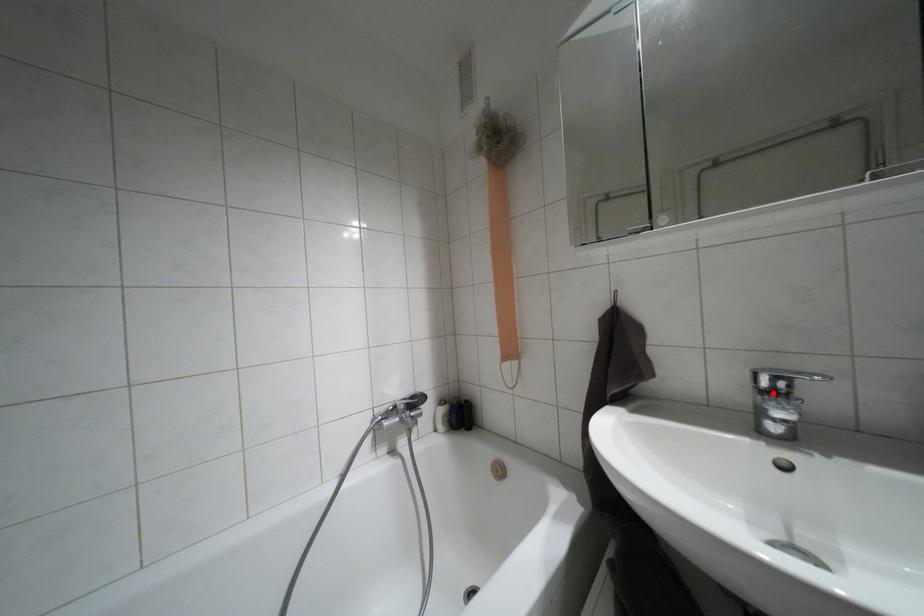
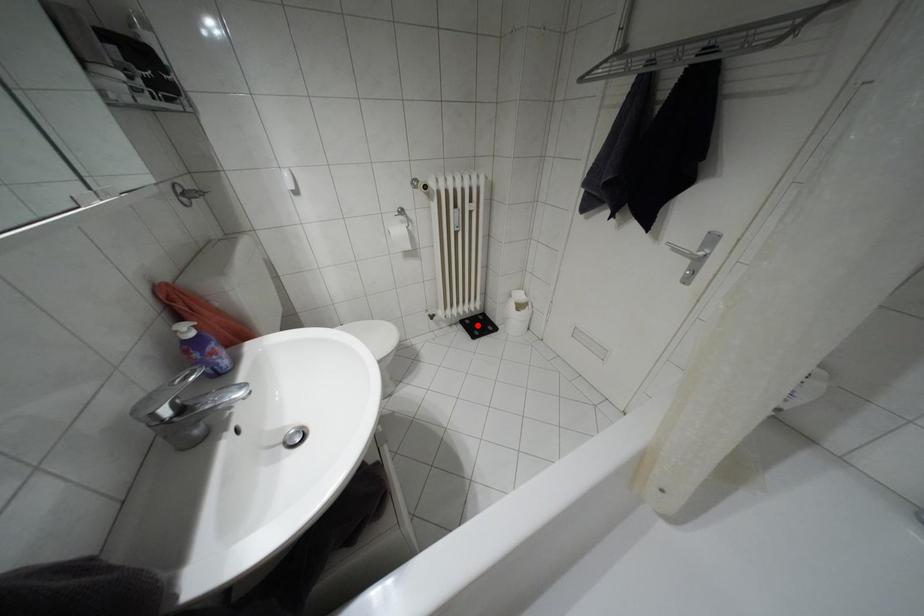
I am providing you with two images of the same scene from different viewpoints. A red point is marked on the first image and another point is marked on the second image. Is the marked point in image1 the same physical position as the marked point in image2?

No